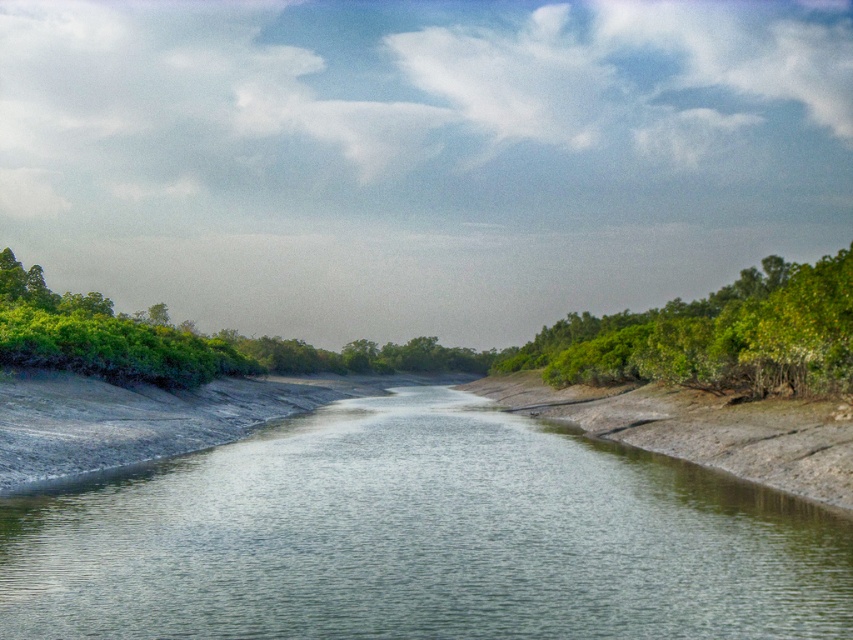
Find the location of a particular element. Image resolution: width=853 pixels, height=640 pixels. clear water at center is located at coordinates (421, 538).

Is clear water at center taller than green leafy shrub at left?

In fact, clear water at center may be shorter than green leafy shrub at left.

Which is in front, point (456, 445) or point (128, 340)?

Point (456, 445) is more forward.

The width and height of the screenshot is (853, 640). In order to click on clear water at center in this screenshot , I will do `click(421, 538)`.

From the picture: Can you confirm if clear water at center is wider than green leafy trees at right?

No, clear water at center is not wider than green leafy trees at right.

Does point (366, 525) lie in front of point (602, 323)?

That is True.

What do you see at coordinates (421, 538) in the screenshot? This screenshot has width=853, height=640. I see `clear water at center` at bounding box center [421, 538].

You are a GUI agent. You are given a task and a screenshot of the screen. Output one action in this format:
    pyautogui.click(x=<x>, y=<y>)
    Task: Click on the clear water at center
    Image resolution: width=853 pixels, height=640 pixels.
    Given the screenshot: What is the action you would take?
    pyautogui.click(x=421, y=538)

Can you confirm if green leafy trees at right is positioned to the right of green leafy shrub at left?

Indeed, green leafy trees at right is positioned on the right side of green leafy shrub at left.

Who is more distant from viewer, (792,262) or (154,356)?

Positioned behind is point (792,262).

Find the location of a particular element. green leafy trees at right is located at coordinates (715, 336).